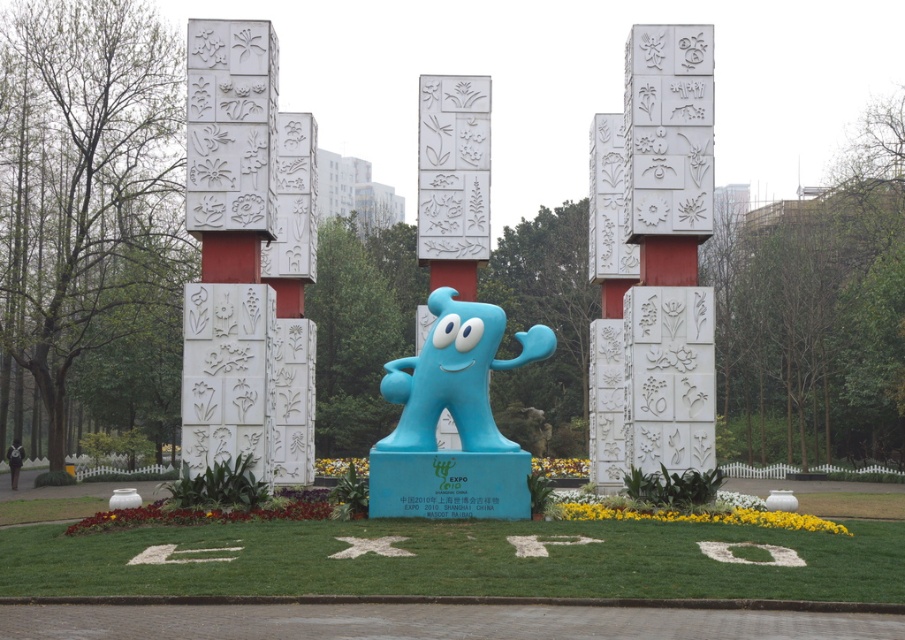
Does white stone pillars at center have a larger size compared to blue rubbery monster at center?

Yes.

Does white stone pillars at center appear on the right side of blue rubbery monster at center?

Yes, white stone pillars at center is to the right of blue rubbery monster at center.

Which is in front, point (678, 234) or point (469, 438)?

Point (469, 438) is more forward.

I want to click on white stone pillars at center, so click(658, 259).

Can you confirm if blue rubber statue at center is positioned to the left of blue rubbery monster at center?

In fact, blue rubber statue at center is to the right of blue rubbery monster at center.

Does blue rubber statue at center appear over blue rubbery monster at center?

Actually, blue rubber statue at center is below blue rubbery monster at center.

Is point (511, 573) in front of point (535, 332)?

Yes, point (511, 573) is in front of point (535, 332).

Where is `blue rubber statue at center`? blue rubber statue at center is located at coordinates (456, 561).

Can you confirm if blue rubber statue at center is taller than white stone pillars at center?

In fact, blue rubber statue at center may be shorter than white stone pillars at center.

Between blue rubber statue at center and white stone pillars at center, which one has less height?

blue rubber statue at center is shorter.

Where is `blue rubber statue at center`? This screenshot has width=905, height=640. blue rubber statue at center is located at coordinates (456, 561).

At what (x,y) coordinates should I click in order to perform the action: click on blue rubber statue at center. Please return your answer as a coordinate pair (x, y). Looking at the image, I should click on [456, 561].